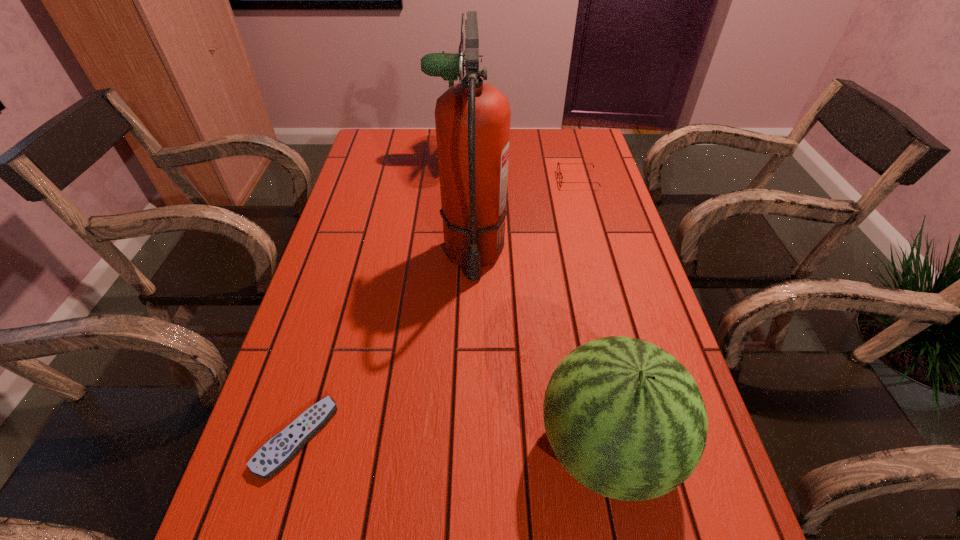
Identify the location of free space at the far left corner. The width and height of the screenshot is (960, 540). (410, 140).

This screenshot has height=540, width=960. I want to click on free space that is in between the watermelon and the fan, so click(x=530, y=302).

You are a GUI agent. You are given a task and a screenshot of the screen. Output one action in this format:
    pyautogui.click(x=<x>, y=<y>)
    Task: Click on the unoccupied area between the second tallest object and the sunglasses
    Image resolution: width=960 pixels, height=540 pixels.
    Given the screenshot: What is the action you would take?
    516,168

Identify the location of empty location between the shortest object and the sunglasses. The height and width of the screenshot is (540, 960). coord(437,308).

Where is `empty location between the watermelon and the sunglasses`? This screenshot has height=540, width=960. empty location between the watermelon and the sunglasses is located at coordinates (591, 314).

The image size is (960, 540). What are the coordinates of `empty space that is in between the second tallest object and the third shortest object` in the screenshot? It's located at (530, 302).

Locate an element on the screen. The image size is (960, 540). vacant area that lies between the fourth tallest object and the third shortest object is located at coordinates (591, 314).

Find the location of a particular element. This screenshot has width=960, height=540. vacant point located between the leftmost object and the fourth tallest object is located at coordinates click(437, 308).

Where is `vacant area between the leftmost object and the third tallest object`? The height and width of the screenshot is (540, 960). vacant area between the leftmost object and the third tallest object is located at coordinates (451, 442).

Locate an element on the screen. free space between the third farthest object and the sunglasses is located at coordinates (526, 218).